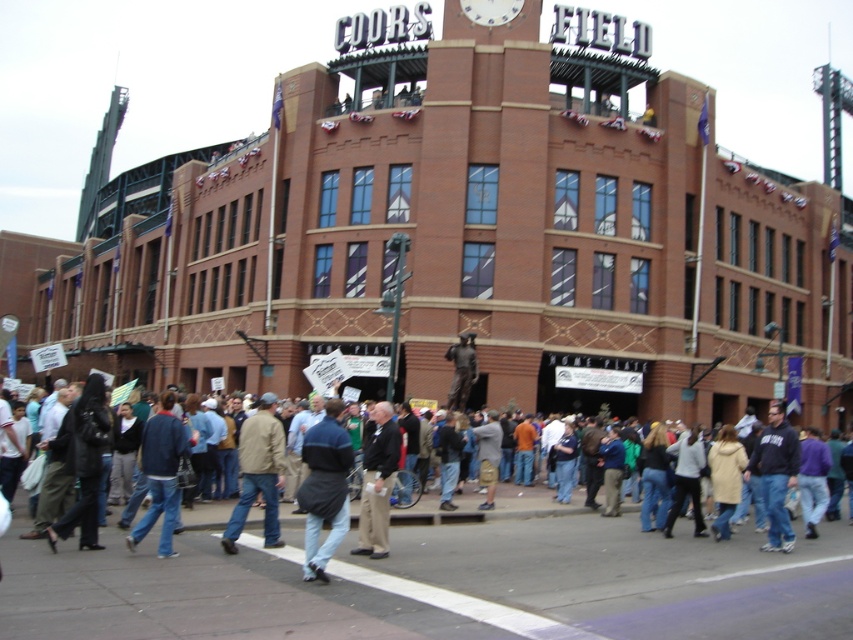
You are standing at the point closest to the stadium entrance. There are two points marked in the scene, one at coordinates point (238, 451) and another at point (782, 515). Which of these points is farther away from your current position?

Point (782, 515) is farther away from your current position because it is in front of point (238, 451), which is behind it.

You are a security officer at Coors Field and need to assess if two individuals, one wearing a dark blue sweatshirt at lower right and the other in a gray cotton shirt at center, are within the 50 feet safety zone required for crowd control. Can you confirm if they are within the 50 feet safety distance?

The distance between the dark blue sweatshirt at lower right and the gray cotton shirt at center is 45.80 feet, which is within the 50 feet safety zone required for crowd control. Therefore, they are within the required distance.